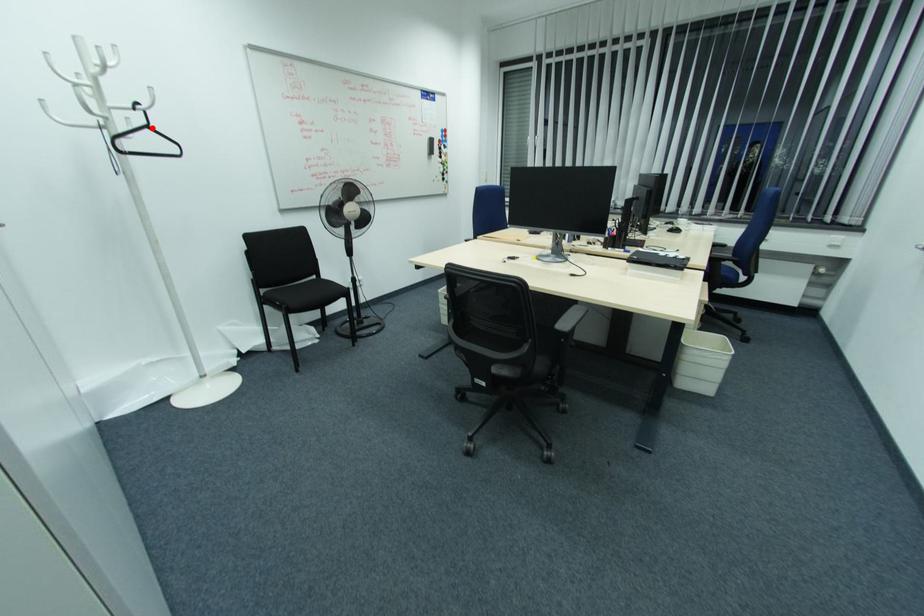
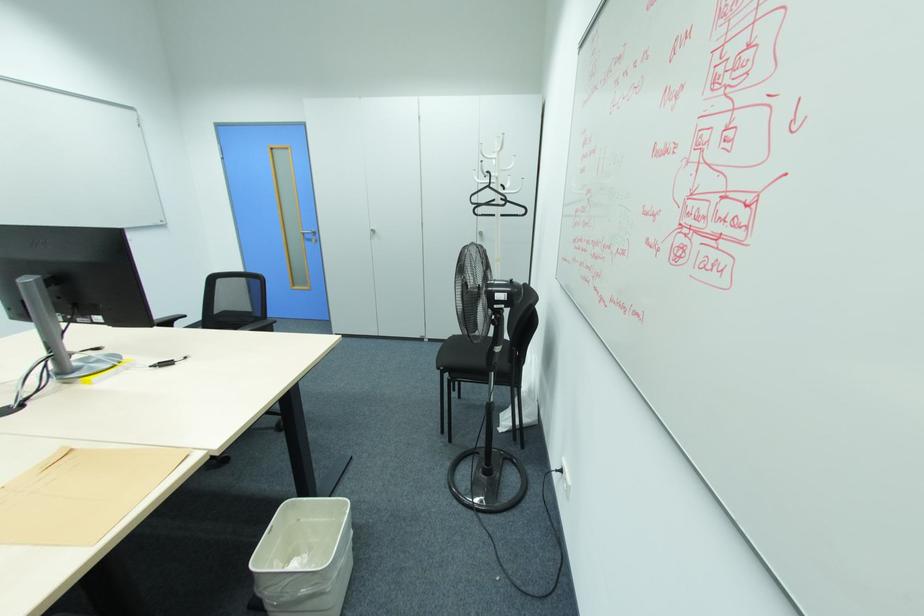
Question: I am providing you with two images of the same scene from different viewpoints. A red point is shown in image1. For the corresponding object point in image2, is it positioned nearer or farther from the camera?

Choices:
 (A) Nearer
 (B) Farther

Answer: (A)